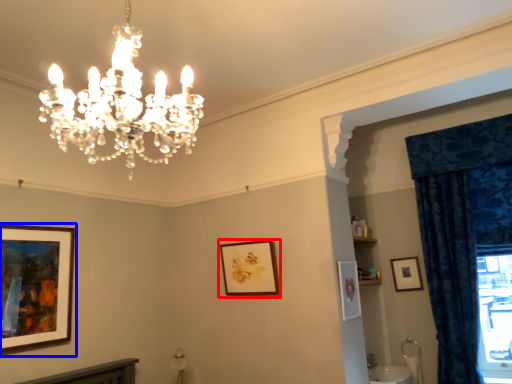
Question: Which object appears farthest to the camera in this image, picture frame (highlighted by a red box) or picture frame (highlighted by a blue box)?

Choices:
 (A) picture frame
 (B) picture frame

Answer: (A)